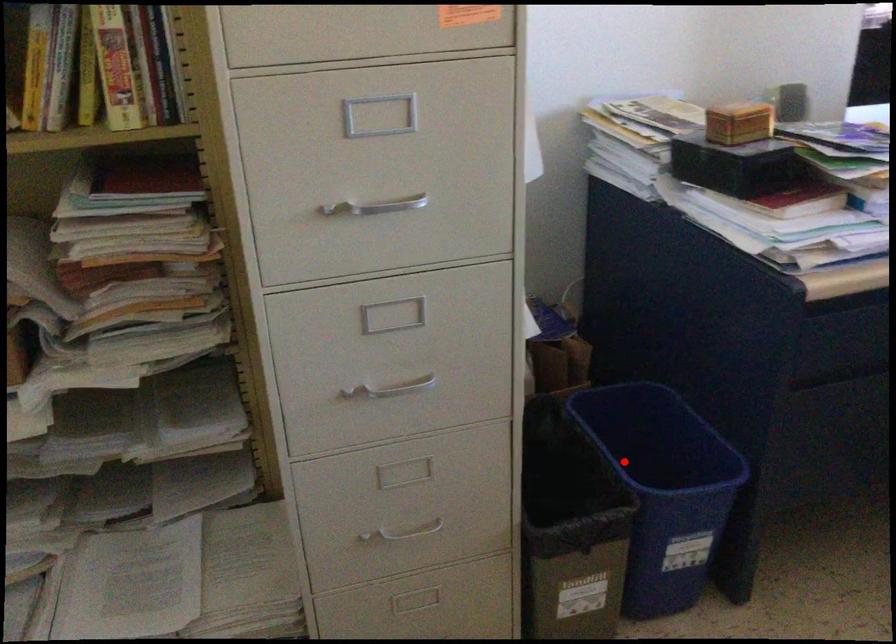
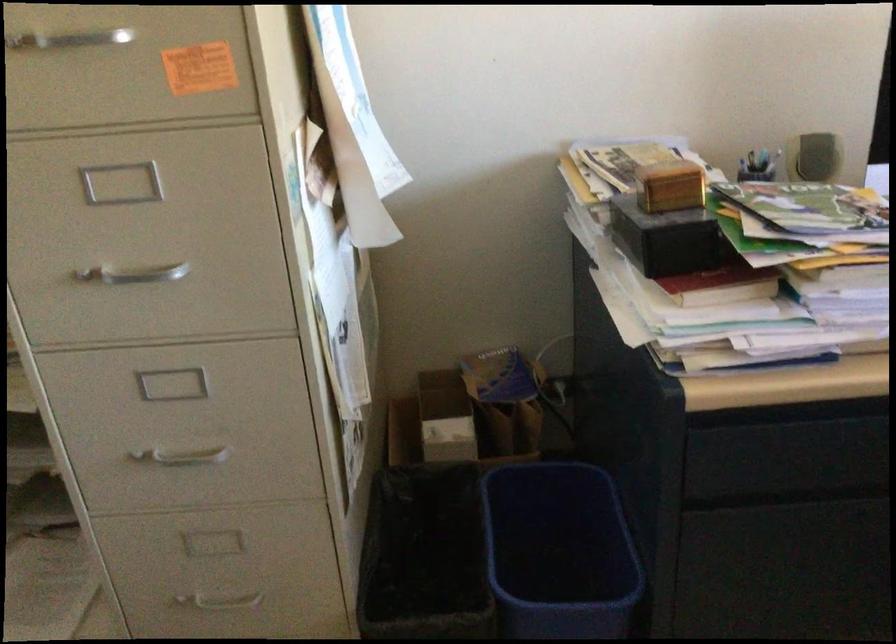
Question: I am providing you with two images of the same scene from different viewpoints. Image1 has a red point marked. In image2, the corresponding 3D location appears at what relative position? Reply with the corresponding letter.

Choices:
 (A) Closer
 (B) Farther

Answer: (A)